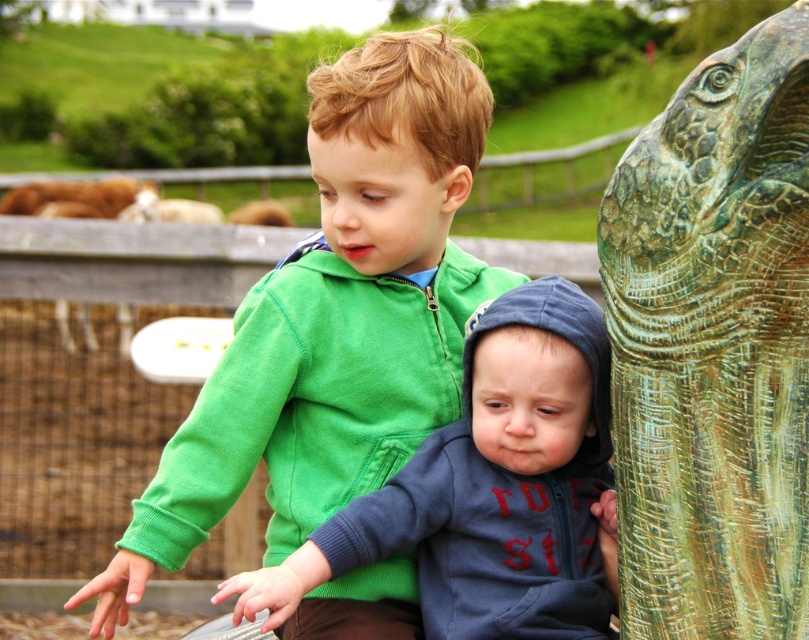
You are standing in a park and see two children near a statue. The statue is at coordinates point (714, 346). What is the statue made of?

The statue at point (714, 346) is made of green patina stone.

You are a photographer standing in front of the green matte hoodie at center and the green patina stone elephant at right. You want to take a photo that includes both subjects clearly. Which subject should you focus on first to ensure both are in sharp focus?

You should focus on the green patina stone elephant at right first because it is farther away than the green matte hoodie at center, ensuring both will be in focus when using depth of field properly.

You are standing in a park and see the green patina stone elephant at right. If you want to touch it, how many steps do you need to take if each step is 0.8 meters?

The green patina stone elephant at right is 4.80 meters away from viewer. Since each step is 0.8 meters, you would need to take 6 steps to reach it.